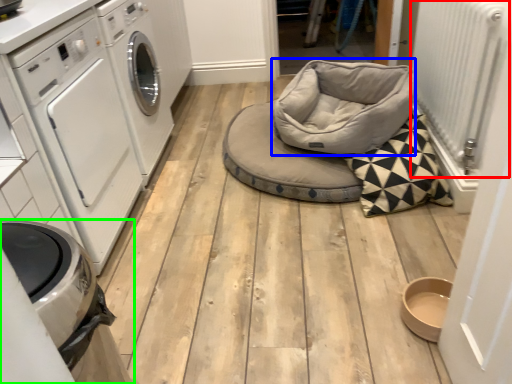
Question: Based on their relative distances, which object is farther from radiator (highlighted by a red box)? Choose from bean bag chair (highlighted by a blue box) and home appliance (highlighted by a green box).

Choices:
 (A) bean bag chair
 (B) home appliance

Answer: (B)